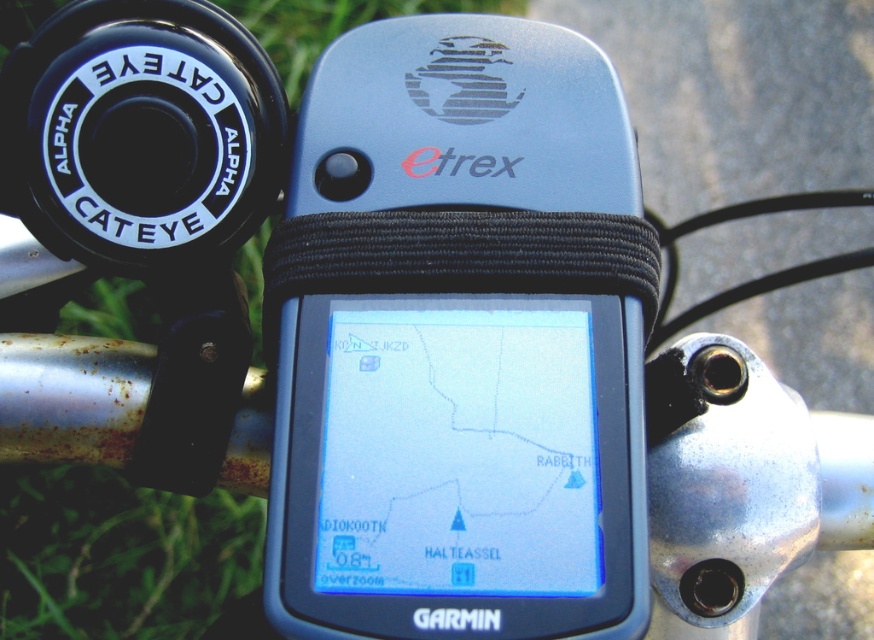
You are a cyclist who wants to check the GPS to navigate a trail. You see the blue plastic gps at center and the green grass at lower left. Which object is nearer to you when looking at the handlebar?

The blue plastic gps at center is closer to the viewer than the green grass at lower left, so the GPS is nearer when looking at the handlebar.

You are a cyclist who wants to reach the point at coordinates point (498, 120) on the handlebar. If your hand can extend 30 inches from your current position, can you reach it?

The point (498, 120) is 27.76 inches away from the viewer. Since your hand can extend 30 inches, you can reach it.